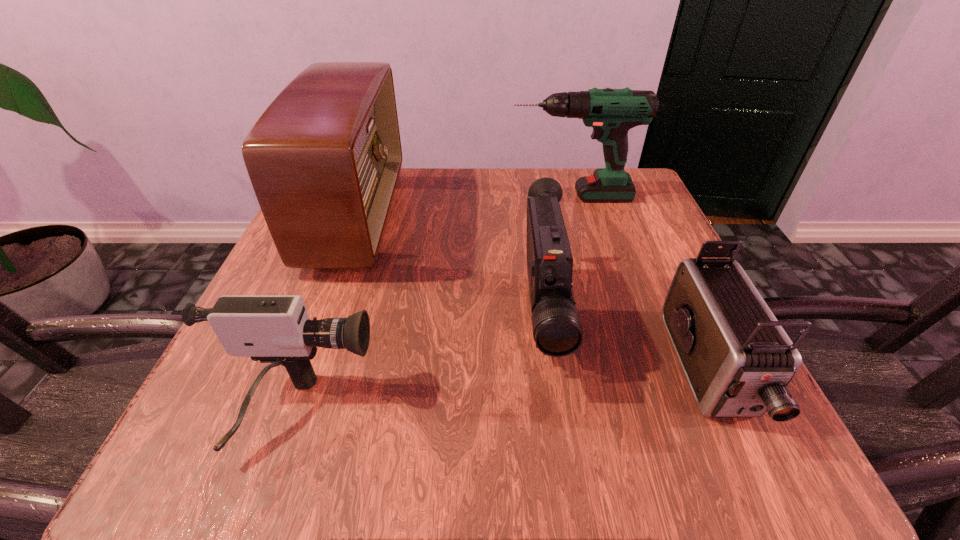
Image resolution: width=960 pixels, height=540 pixels. What are the coordinates of `radio receiver` in the screenshot? It's located at (324, 159).

Find the location of `drill`. drill is located at coordinates (612, 113).

At what (x,y) coordinates should I click in order to perform the action: click on the second camcorder from right to left. Please return your answer as a coordinate pair (x, y). This screenshot has height=540, width=960. Looking at the image, I should click on (557, 331).

Image resolution: width=960 pixels, height=540 pixels. What are the coordinates of `the rightmost camcorder` in the screenshot? It's located at (738, 360).

This screenshot has height=540, width=960. Find the location of `the leftmost camcorder`. the leftmost camcorder is located at coordinates (276, 329).

This screenshot has height=540, width=960. I want to click on vacant space located 0.290m on the front-facing side of the radio receiver, so click(x=529, y=218).

Find the location of a particular element. The width and height of the screenshot is (960, 540). free space located on the handle side of the drill is located at coordinates pos(488,197).

Find the location of a particular element. The image size is (960, 540). vacant space located on the handle side of the drill is located at coordinates (462, 197).

Image resolution: width=960 pixels, height=540 pixels. Find the location of `free point located 0.140m on the handle side of the drill`. free point located 0.140m on the handle side of the drill is located at coordinates (448, 197).

Find the location of `vacant space located 0.090m on the front-facing side of the second camcorder from right to left`. vacant space located 0.090m on the front-facing side of the second camcorder from right to left is located at coordinates (562, 459).